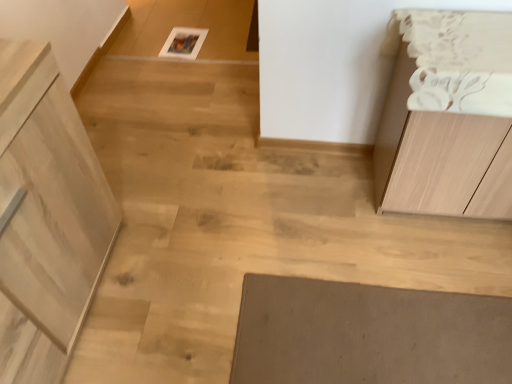
Identify the location of vacant area on top of light wood cabinet at right, positioned as the second cabinetry in left-to-right order (from a real-world perspective). (472, 40).